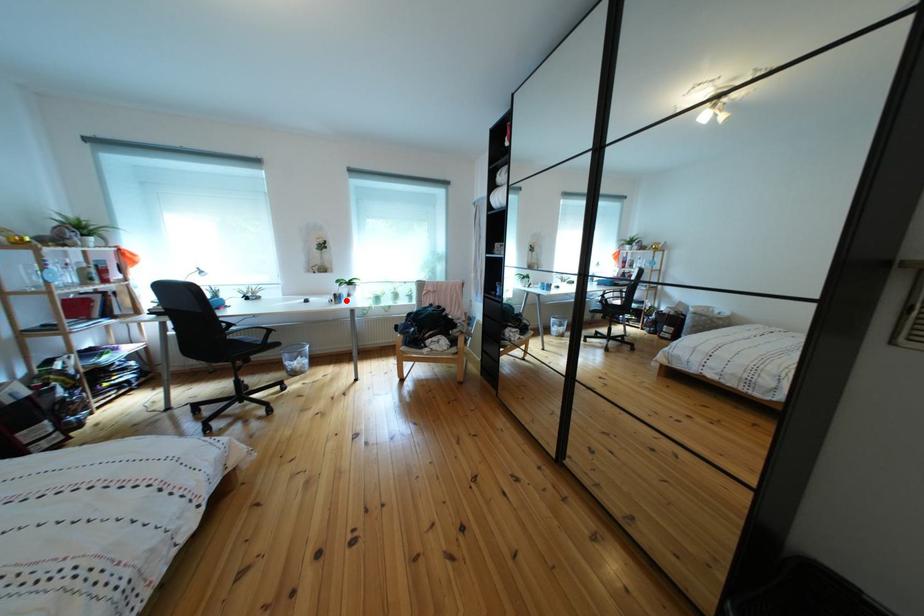
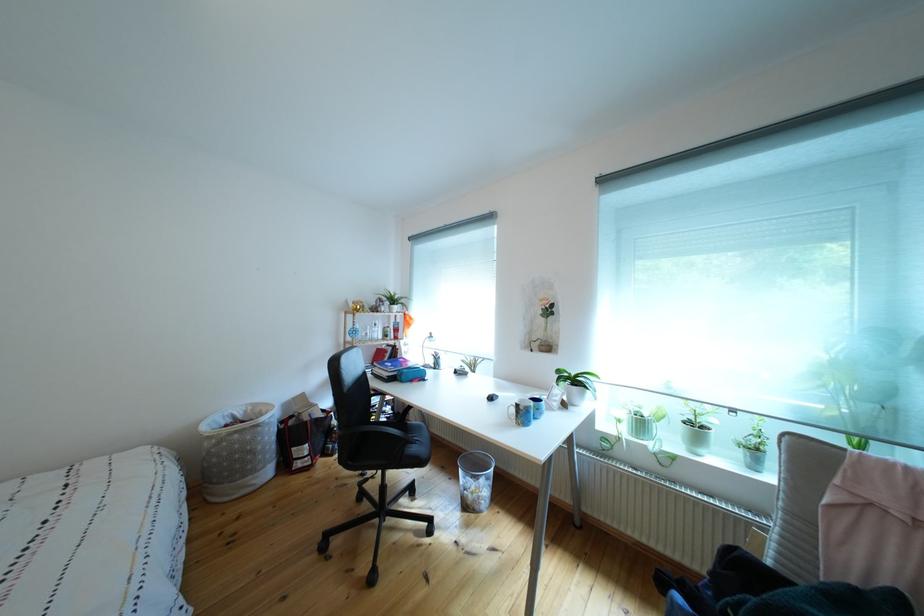
Find the pixel in the second image that matches the highlighted location in the first image.

(529, 411)